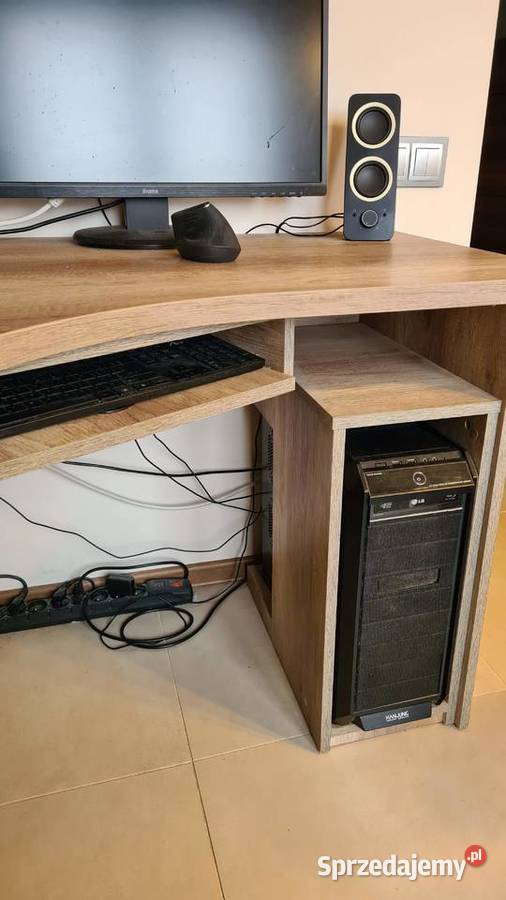
Locate an element on the screen. This screenshot has width=506, height=900. light switch is located at coordinates (424, 158), (405, 163).